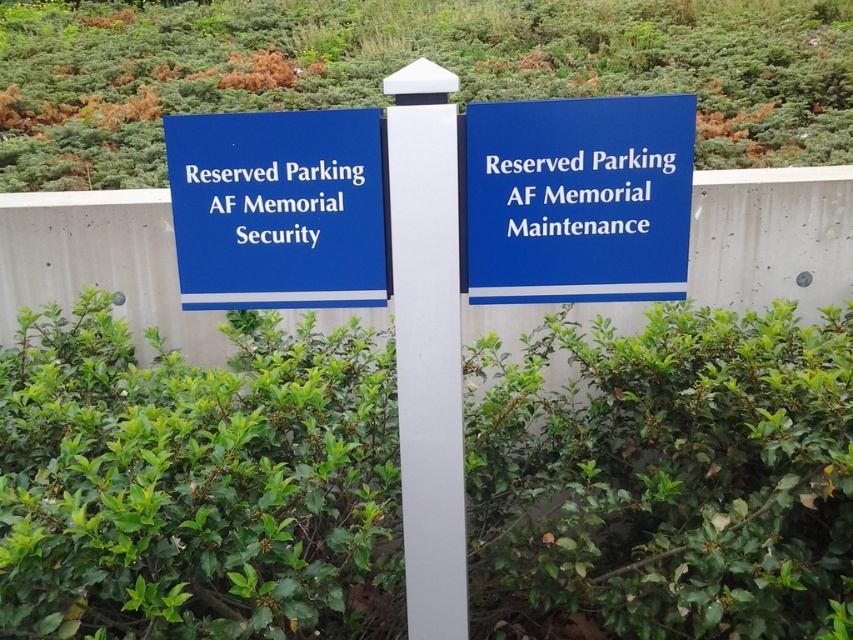
You are a landscape designer planning to replace the green leafy hedge at center and the white smooth pole at center with new plants. If you want to keep the same spatial proportions, which object should you choose a wider plant for?

The green leafy hedge at center is wider than the white smooth pole at center, so you should choose a wider plant to replace the green leafy hedge at center and a narrower one for the white smooth pole at center to maintain the same spatial proportions.

You are standing in front of the two blue signs on the white post. There is a green leafy hedge somewhere in the scene. Where is the green leafy hedge at center located?

The green leafy hedge at center is located at point (196, 483).